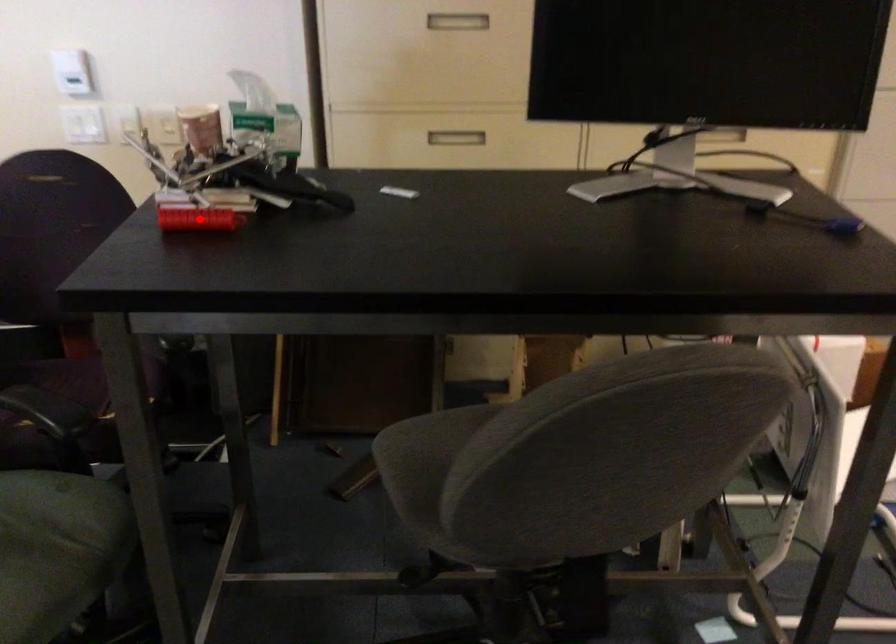
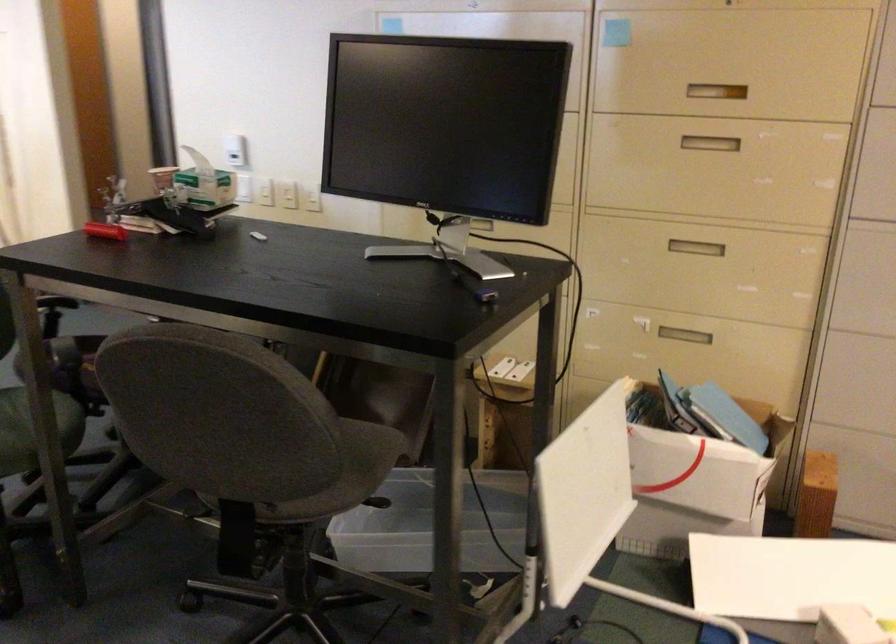
The point at the highlighted location is marked in the first image. Where is the corresponding point in the second image?

(104, 231)